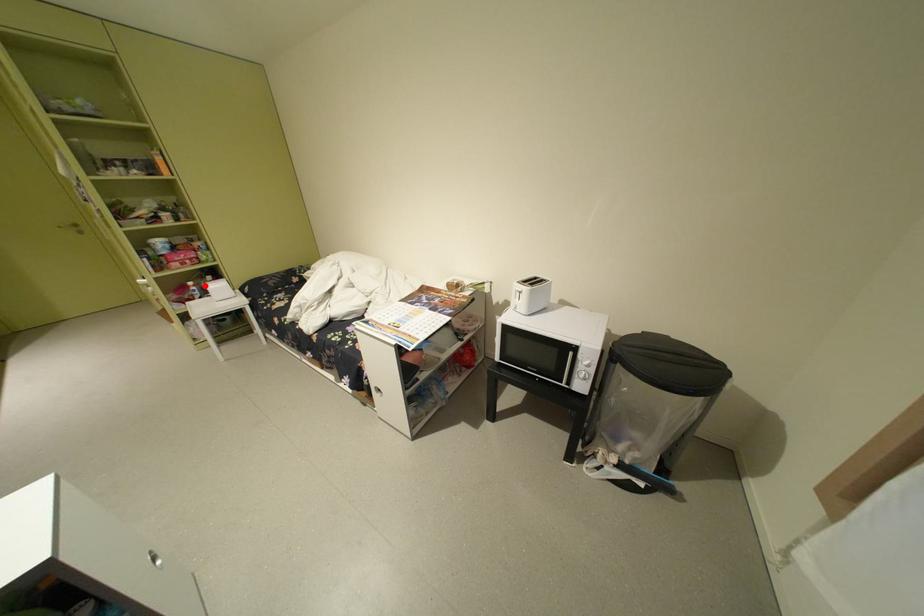
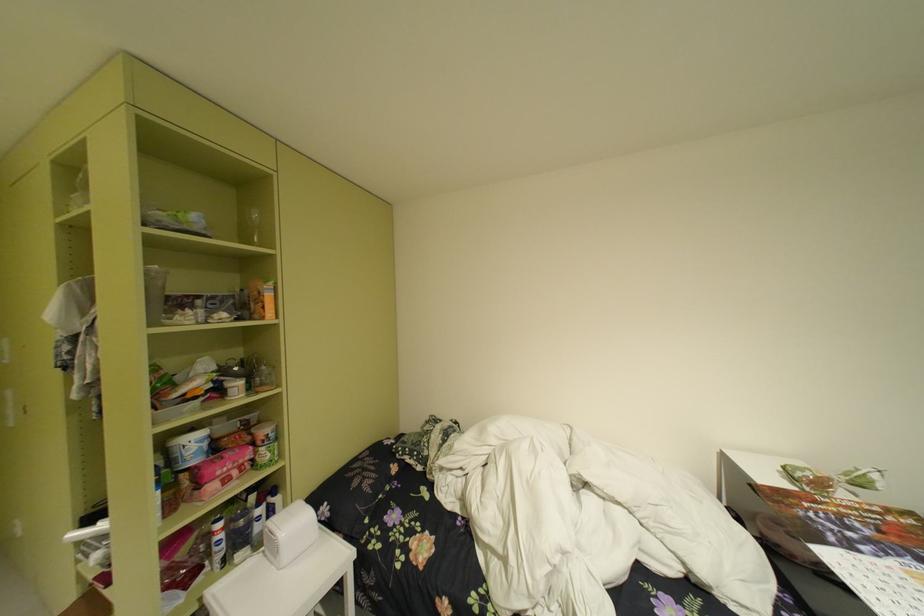
The point at the highlighted location is marked in the first image. Where is the corresponding point in the second image?

(235, 528)